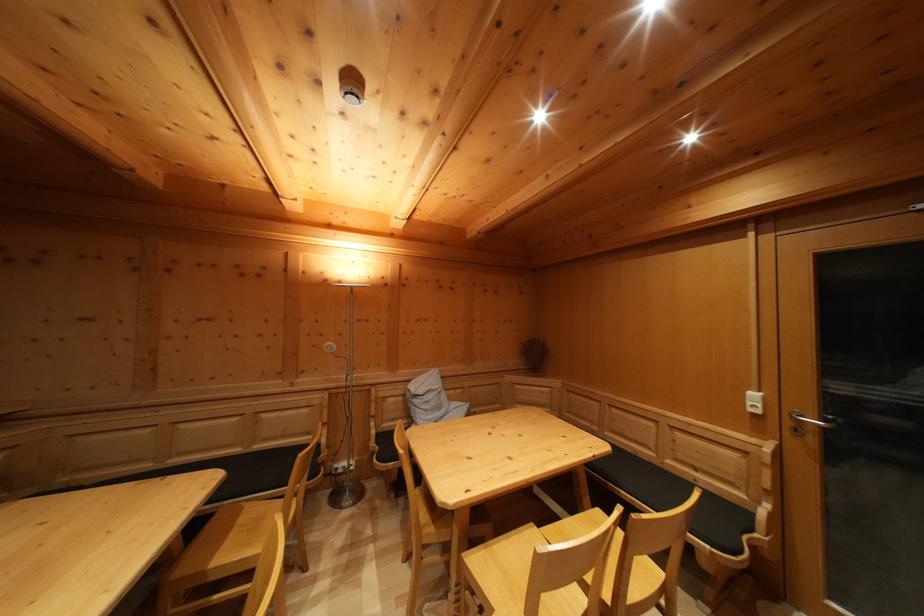
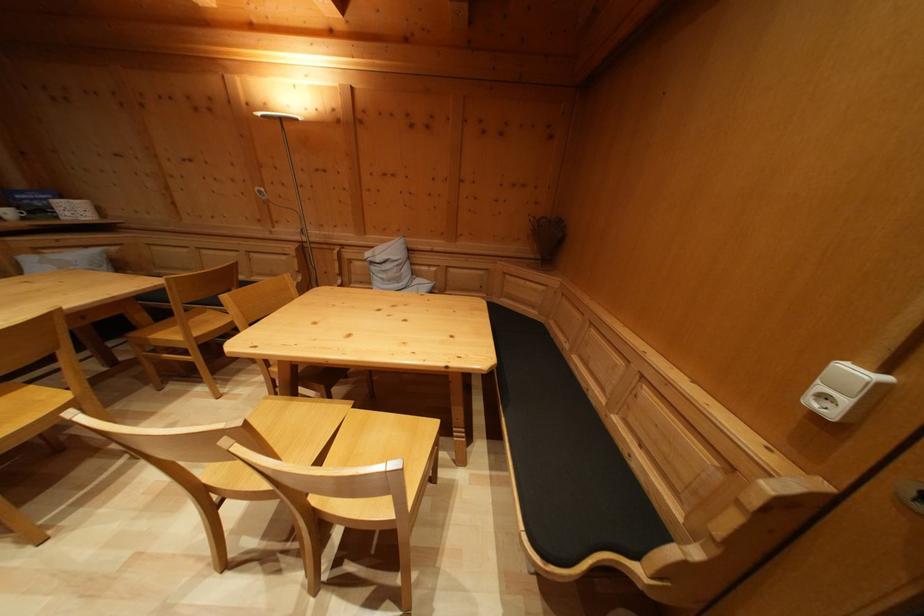
The point at (760,402) is marked in the first image. Where is the corresponding point in the second image?

(859, 379)